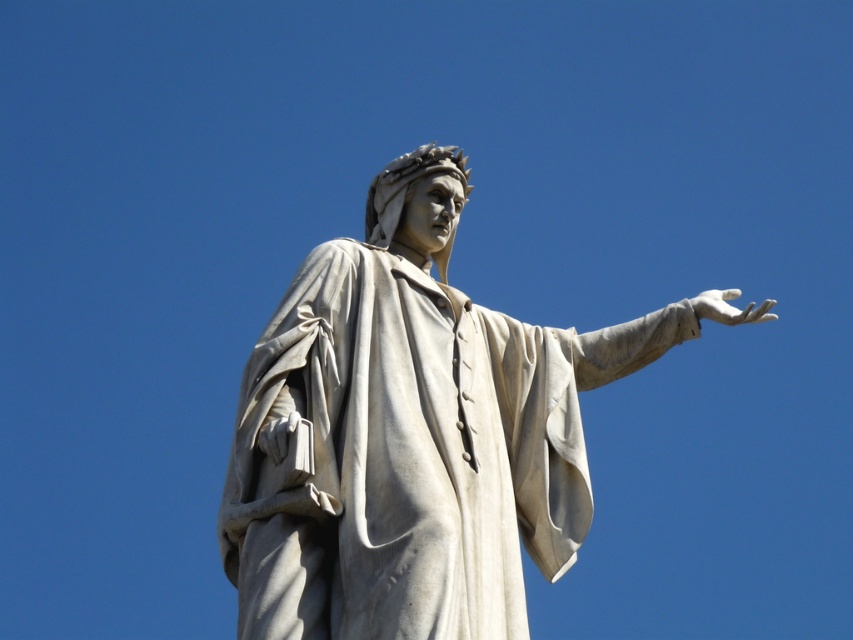
You are standing in front of the statue and want to touch both the white marble statue at center and the white marble hand at right. Which one should you reach for first if you want to touch the closest object?

The white marble statue at center is closer because it is in front of the white marble hand at right.

You are a visitor standing in front of the statue. You notice the white marble hand at right and the white marble statue at center. Which object is closer to the ground?

The white marble statue at center is closer to the ground because it is positioned under the white marble hand at right.

You are an art student analyzing the statue. You notice the white marble statue at center and the white marble hand at right. Which object is significantly larger?

The white marble statue at center is much taller than the white marble hand at right.